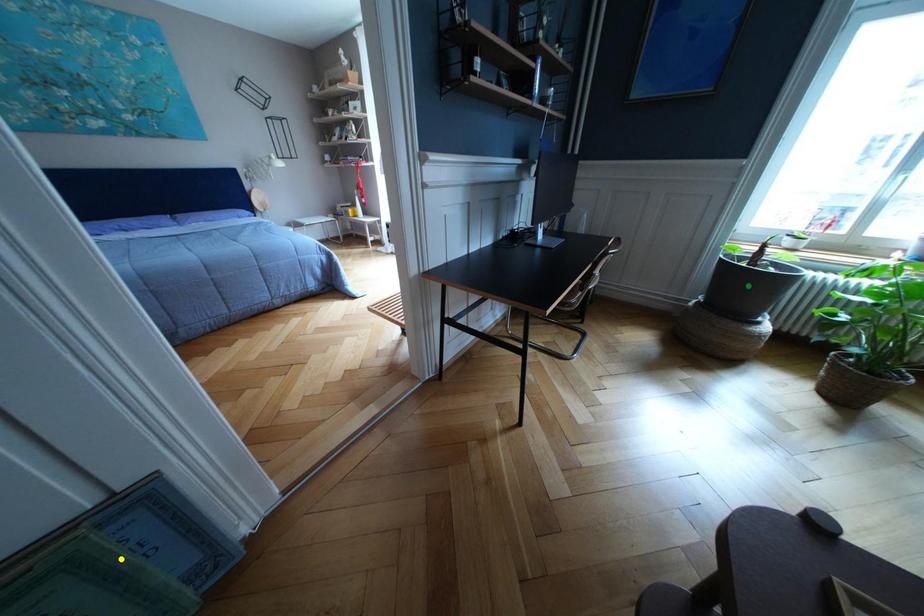
Order these from nearest to farthest:
- green point
- yellow point
- blue point

yellow point, blue point, green point